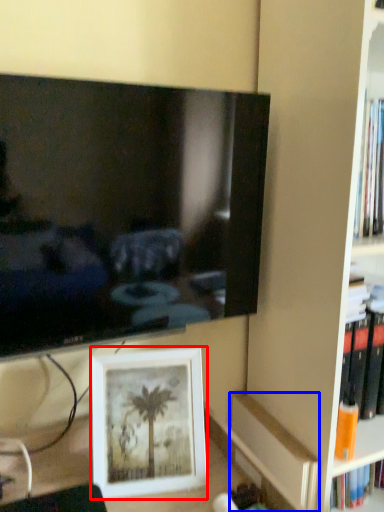
Question: Which object is further to the camera taking this photo, picture frame (highlighted by a red box) or paperback book (highlighted by a blue box)?

Choices:
 (A) picture frame
 (B) paperback book

Answer: (B)